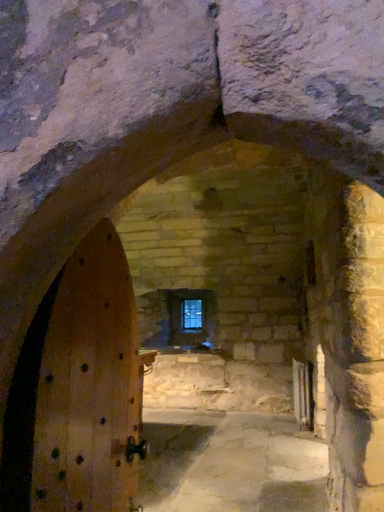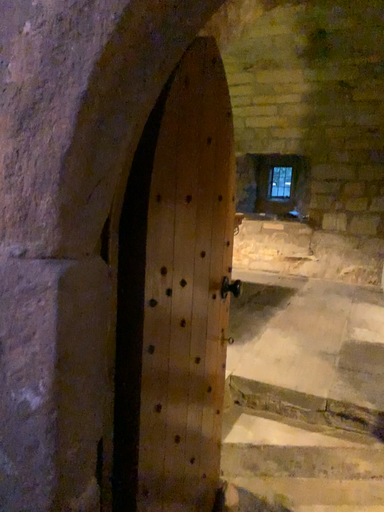
Question: Which way did the camera rotate in the video?

Choices:
 (A) rotated downward
 (B) rotated upward

Answer: (A)